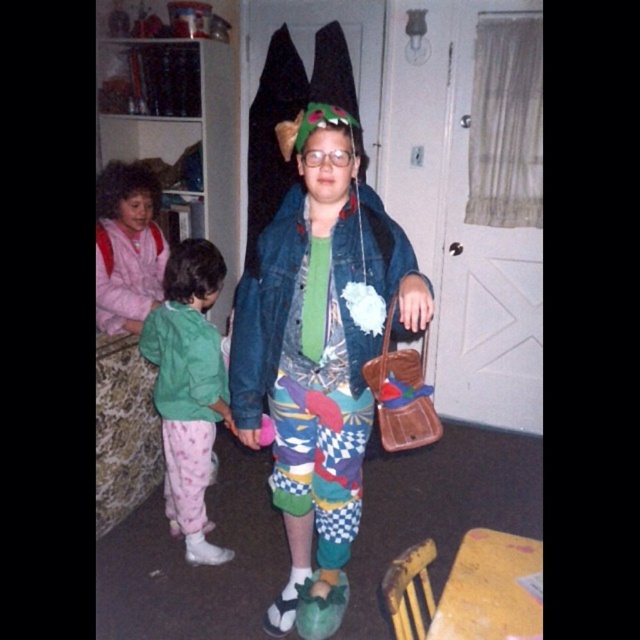
Does faded denim jacket at center have a lesser height compared to matte pink pajamas at left?

Incorrect, faded denim jacket at center's height does not fall short of matte pink pajamas at left's.

Is faded denim jacket at center thinner than matte pink pajamas at left?

In fact, faded denim jacket at center might be wider than matte pink pajamas at left.

What are the coordinates of `faded denim jacket at center` in the screenshot? It's located at pyautogui.click(x=317, y=342).

What do you see at coordinates (124, 337) in the screenshot?
I see `matte pink pajamas at left` at bounding box center [124, 337].

This screenshot has width=640, height=640. In order to click on matte pink pajamas at left in this screenshot , I will do `click(124, 337)`.

Describe the element at coordinates (124, 337) in the screenshot. I see `matte pink pajamas at left` at that location.

I want to click on matte pink pajamas at left, so click(124, 337).

Which of these two, faded denim jacket at center or green fleece jacket at lower left, stands taller?

faded denim jacket at center is taller.

The width and height of the screenshot is (640, 640). What do you see at coordinates (317, 342) in the screenshot?
I see `faded denim jacket at center` at bounding box center [317, 342].

Find the location of `faded denim jacket at center`. faded denim jacket at center is located at coordinates (317, 342).